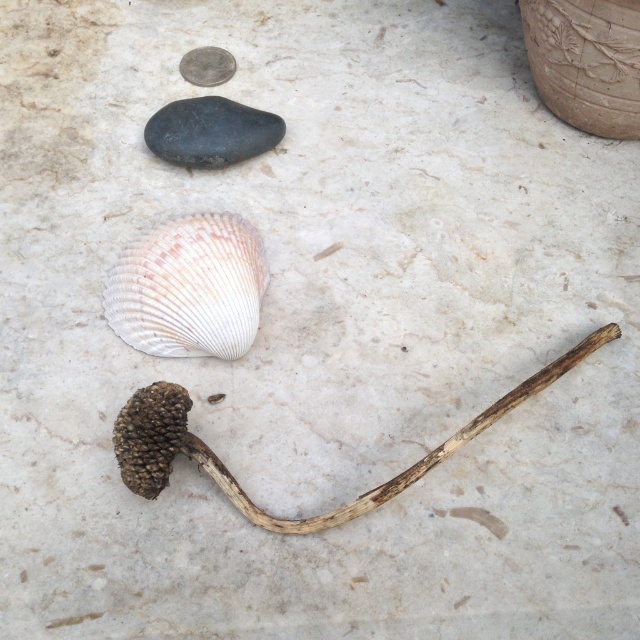
Question: Is pearly white shell at center closer to camera compared to black smooth rock at upper left?

Choices:
 (A) no
 (B) yes

Answer: (B)

Question: Among these objects, which one is farthest from the camera?

Choices:
 (A) brown rough twig at center
 (B) pearly white shell at center

Answer: (B)

Question: Can you confirm if brown rough twig at center is smaller than black smooth rock at upper left?

Choices:
 (A) yes
 (B) no

Answer: (B)

Question: Does brown rough twig at center appear on the left side of black smooth rock at upper left?

Choices:
 (A) yes
 (B) no

Answer: (B)

Question: Among these objects, which one is farthest from the camera?

Choices:
 (A) pearly white shell at center
 (B) brown rough twig at center
 (C) black smooth rock at upper left

Answer: (C)

Question: Which point appears farthest from the camera in this image?

Choices:
 (A) (273, 128)
 (B) (192, 244)
 (C) (518, 394)

Answer: (A)